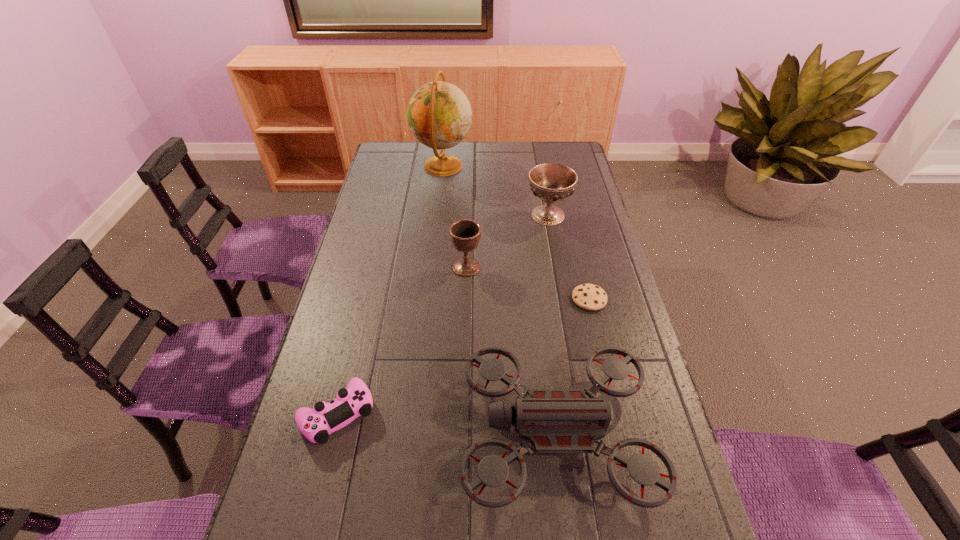
Find the location of a particular element. control located in the left edge section of the desktop is located at coordinates click(316, 424).

The width and height of the screenshot is (960, 540). In order to click on chalice that is at the right edge in this screenshot , I will do `click(551, 182)`.

Image resolution: width=960 pixels, height=540 pixels. In order to click on drone at the right edge in this screenshot , I will do `click(553, 420)`.

The image size is (960, 540). Identify the location of cookie that is at the right edge. (587, 296).

Locate an element on the screen. This screenshot has width=960, height=540. object situated at the far left corner is located at coordinates (439, 114).

The height and width of the screenshot is (540, 960). I want to click on free space at the far edge of the desktop, so click(417, 167).

Find the location of `free space at the left edge of the desktop`. free space at the left edge of the desktop is located at coordinates (326, 446).

The image size is (960, 540). I want to click on free space at the far left corner of the desktop, so click(407, 146).

Find the location of `vacant area that lies between the fifth nearest object and the third shortest object`. vacant area that lies between the fifth nearest object and the third shortest object is located at coordinates (552, 324).

Identify the location of free point between the fifth nearest object and the third farthest object. (507, 241).